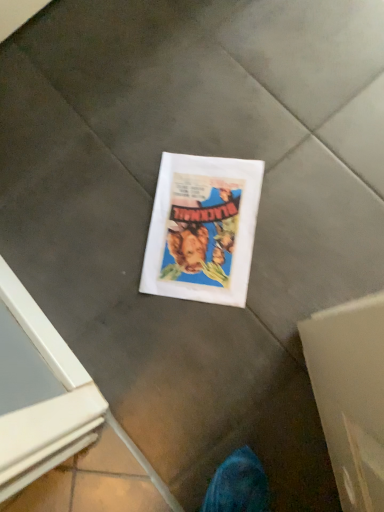
Find the location of a particular element. The image size is (384, 512). empty space that is ontop of white paper at center (from a real-world perspective) is located at coordinates (206, 228).